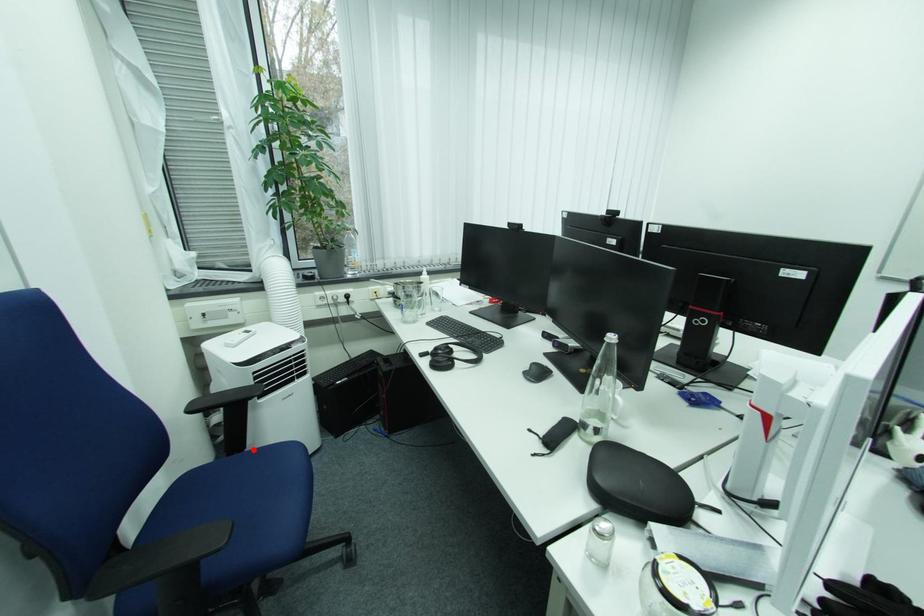
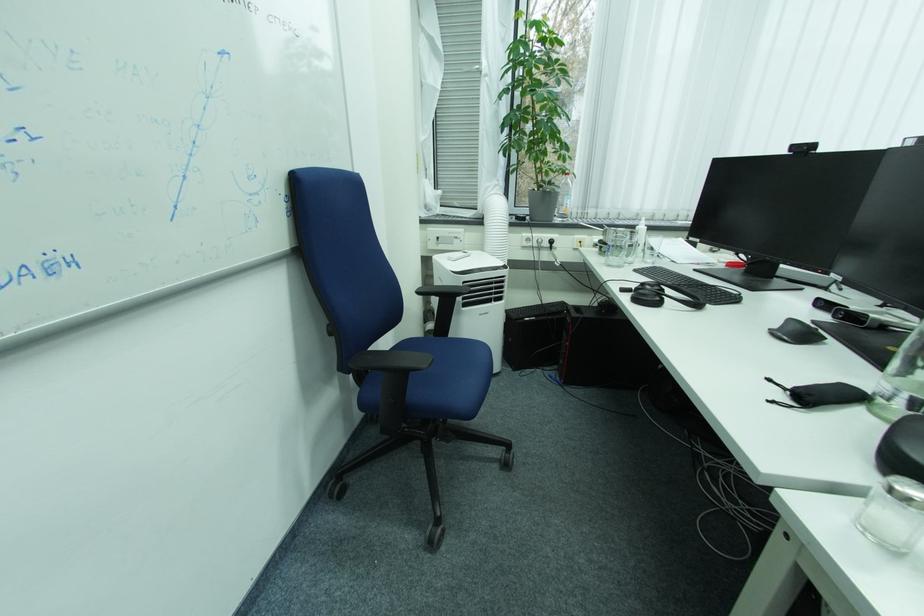
Find the pixel in the second image that matches the highlighted location in the first image.

(455, 338)